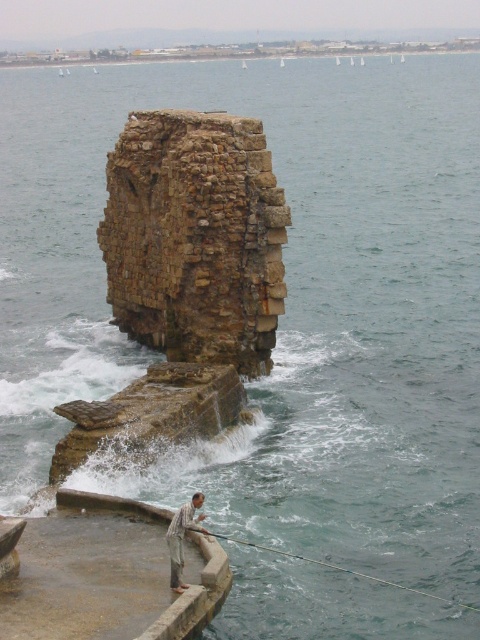
Is light gray cotton shirt at lower center taller than metallic wire fishing pole at lower center?

In fact, light gray cotton shirt at lower center may be shorter than metallic wire fishing pole at lower center.

Between light gray cotton shirt at lower center and metallic wire fishing pole at lower center, which one is positioned higher?

light gray cotton shirt at lower center

Where is `light gray cotton shirt at lower center`? The image size is (480, 640). light gray cotton shirt at lower center is located at coordinates (182, 538).

This screenshot has height=640, width=480. I want to click on light gray cotton shirt at lower center, so click(182, 538).

What do you see at coordinates (195, 237) in the screenshot? This screenshot has height=640, width=480. I see `rusty stone pillar at center` at bounding box center [195, 237].

Where is `rusty stone pillar at center`? rusty stone pillar at center is located at coordinates (195, 237).

Who is more forward, (x=194, y=298) or (x=178, y=579)?

Point (x=178, y=579)

Locate an element on the screen. The image size is (480, 640). rusty stone pillar at center is located at coordinates (195, 237).

Does point (60, 563) lie in front of point (195, 500)?

No, (60, 563) is behind (195, 500).

Which is more to the left, smooth concrete dock at lower left or light gray cotton shirt at lower center?

smooth concrete dock at lower left is more to the left.

Who is more forward, (41, 593) or (180, 573)?

Positioned in front is point (180, 573).

At what (x,y) coordinates should I click in order to perform the action: click on smooth concrete dock at lower left. Please return your answer as a coordinate pair (x, y). The width and height of the screenshot is (480, 640). Looking at the image, I should click on (108, 573).